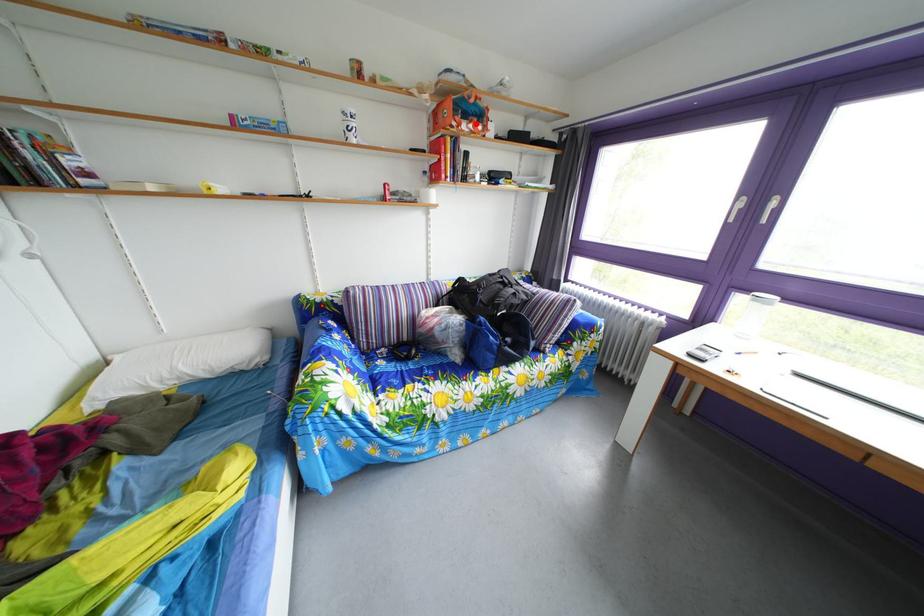
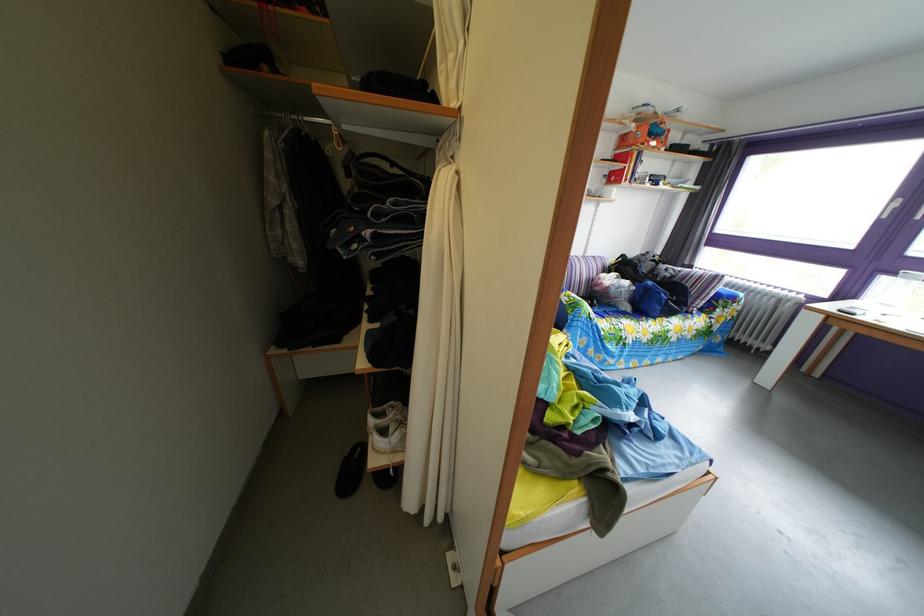
Locate, in the second image, the point that corresponds to the highlighted location in the first image.

(661, 144)